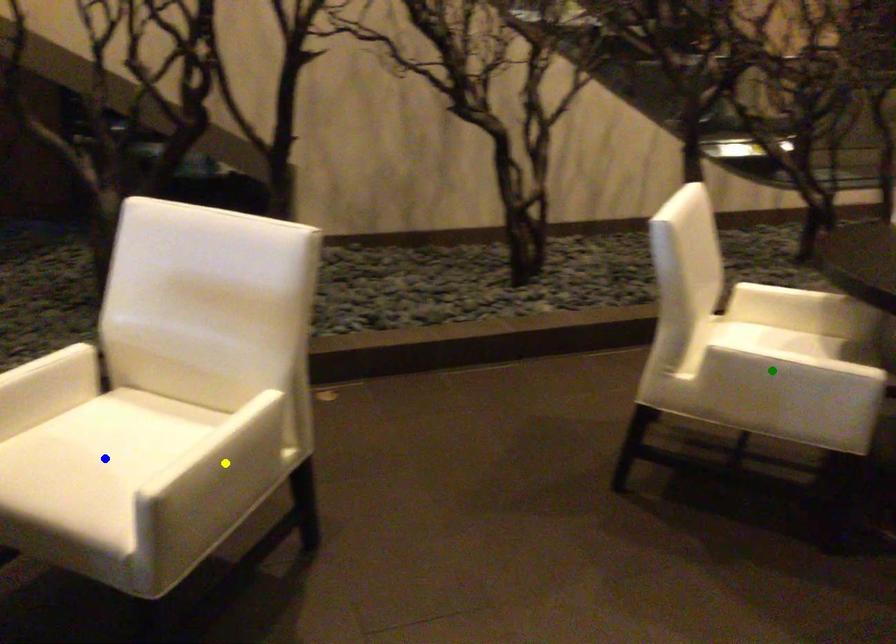
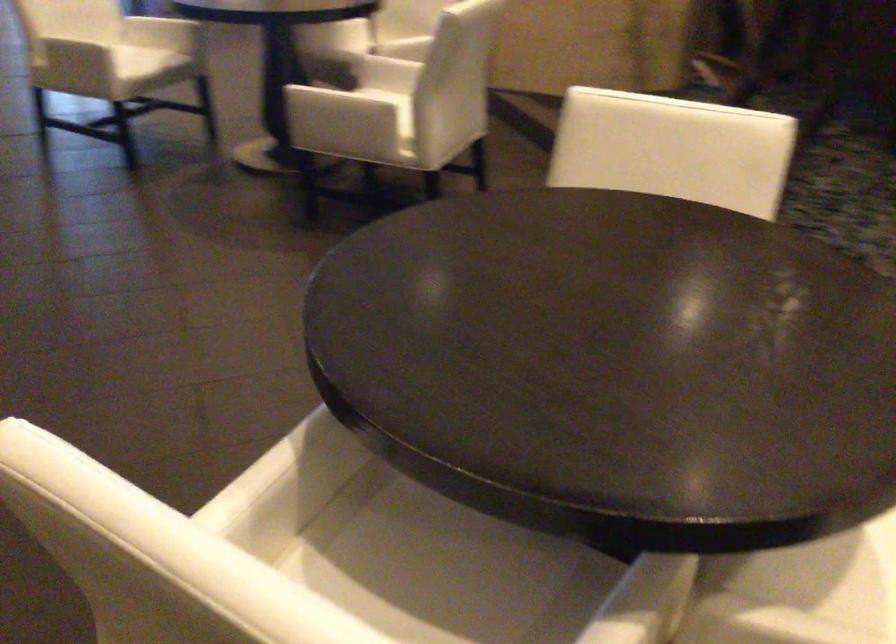
I am providing you with two images of the same scene from different viewpoints. Three points are marked in image1. Which point corresponds to a part or object that is occluded in image2?In image1, three points are marked. Which of them correspond to a part or object that is occluded in image2?Among the three points shown in image1, which one corresponds to a part or object that is no longer visible due to occlusion in image2?

blue point, yellow point, green point cannot be seen in image2.